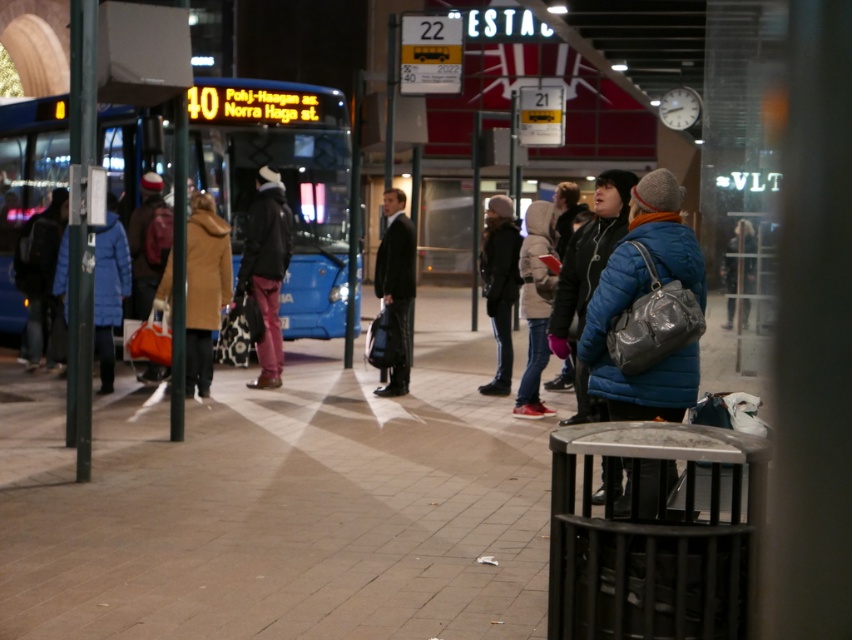
You are a delivery person trying to locate the customer wearing both the white fuzzy coat at center and dark blue jeans at center. The delivery requires both items to be visible. Can you confirm if the customer is wearing both items in a way that allows the delivery to proceed?

The white fuzzy coat at center and dark blue jeans at center are 21.61 inches apart from each other, meaning they are separate items worn by the same person. The delivery can proceed as both items are visible on the customer.

You are a photographer trying to capture a candid shot of the white fuzzy coat at center and the dark blue jeans at center. Since you want to ensure both are visible in the frame, which clothing item should you focus on to avoid cropping out either?

The white fuzzy coat at center is wider than the dark blue jeans at center, so you should focus on the white fuzzy coat at center to ensure both are fully visible in the frame.